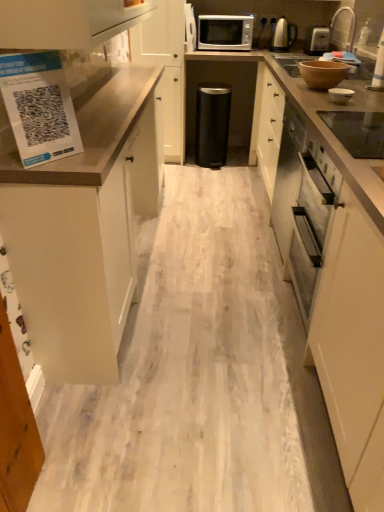
Identify the location of vacant space that is in between black matte trash can at center, positioned as the 1th appliance in back-to-front order, and white matte cabinet at left, the 2th cabinetry when ordered from back to front. (189, 216).